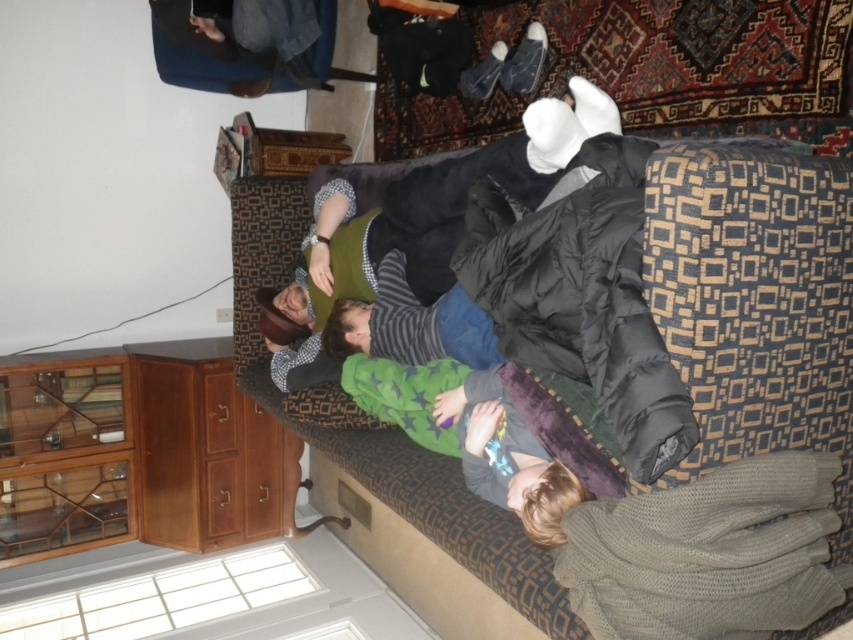
Looking at this image, how much distance is there between green knitted sleeping bag at lower right and green fabric shirt at center?

A distance of 1.57 meters exists between green knitted sleeping bag at lower right and green fabric shirt at center.

Consider the image. Is green knitted sleeping bag at lower right to the right of green fabric shirt at center from the viewer's perspective?

Correct, you'll find green knitted sleeping bag at lower right to the right of green fabric shirt at center.

In order to click on green knitted sleeping bag at lower right in this screenshot , I will do `click(708, 554)`.

What are the coordinates of `green knitted sleeping bag at lower right` in the screenshot? It's located at (708, 554).

Who is more distant from viewer, (804, 372) or (572, 488)?

The point (572, 488) is more distant.

Identify the location of dark brown fabric couch at center. This screenshot has height=640, width=853. (735, 296).

Which of these two, green fuzzy blanket at center or green fabric shirt at center, stands taller?

green fuzzy blanket at center

Does green fuzzy blanket at center have a smaller size compared to green fabric shirt at center?

No, green fuzzy blanket at center is not smaller than green fabric shirt at center.

This screenshot has width=853, height=640. In order to click on green fuzzy blanket at center in this screenshot , I will do `click(469, 435)`.